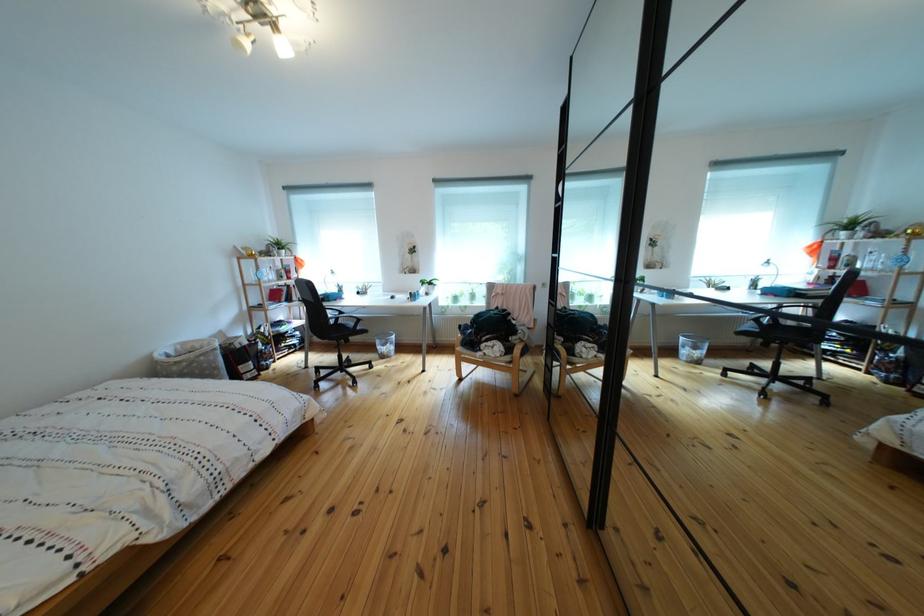
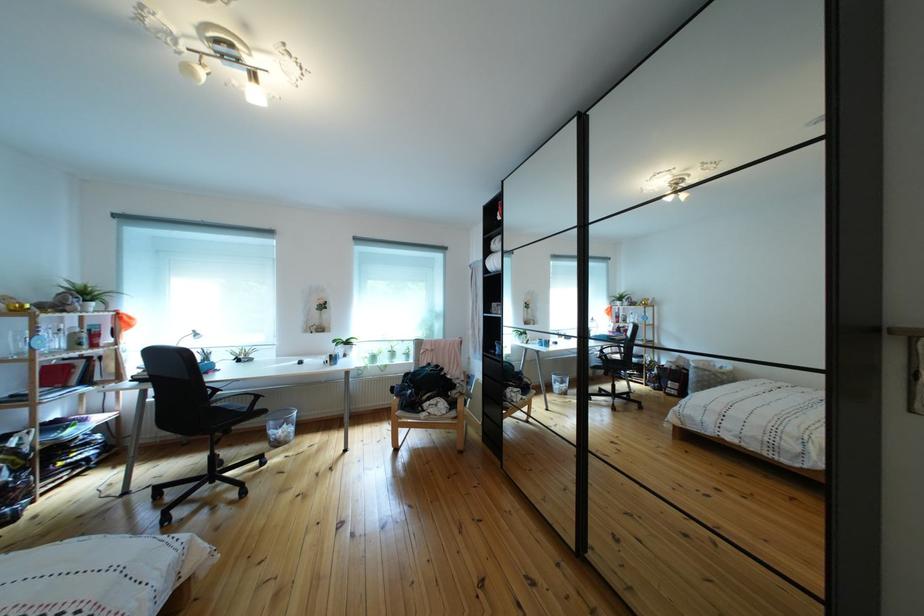
Question: Based on the continuous images, in which direction is the camera rotating? Reply with the corresponding letter.

Choices:
 (A) Left
 (B) Right
 (C) Up
 (D) Down

Answer: (B)